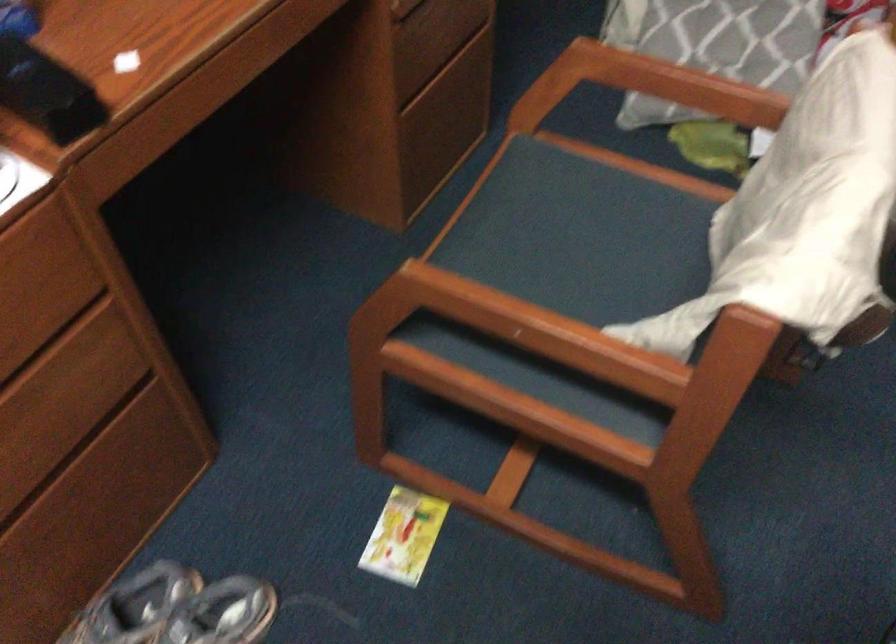
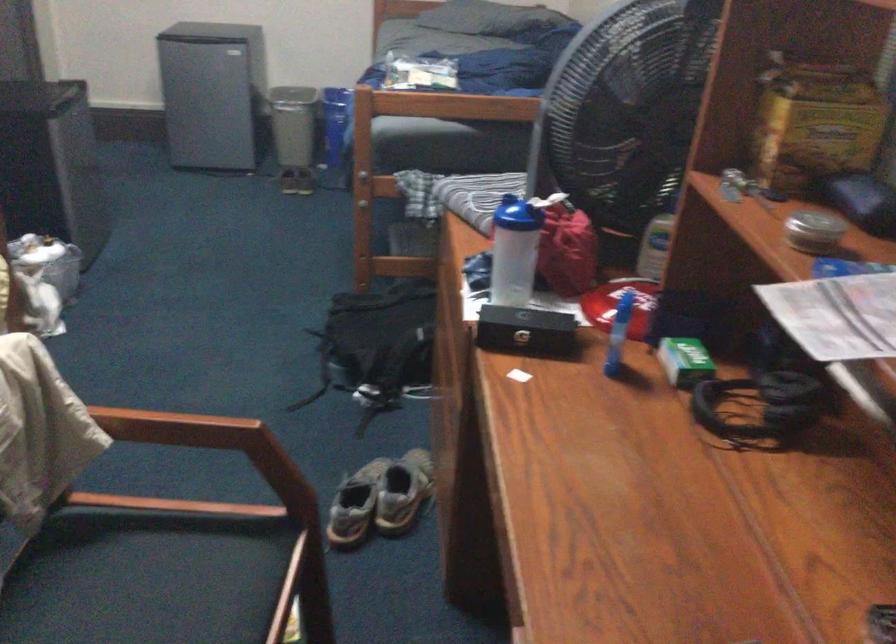
In the second image, find the point that corresponds to the point at 570,286 in the first image.

(162, 579)